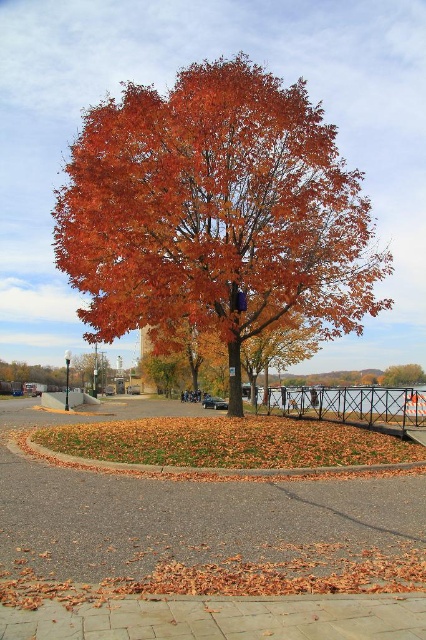
Question: Based on their relative distances, which object is farther from the orange matte tree at center?

Choices:
 (A) brown brick pavement at center
 (B) shiny orange leaves at center

Answer: (A)

Question: Does brown brick pavement at center have a greater width compared to orange matte tree at center?

Choices:
 (A) no
 (B) yes

Answer: (B)

Question: Is brown brick pavement at center above orange matte tree at center?

Choices:
 (A) no
 (B) yes

Answer: (B)

Question: Which point is closer to the camera taking this photo?

Choices:
 (A) (210, 161)
 (B) (81, 376)
 (C) (114, 497)

Answer: (C)

Question: Does shiny orange leaves at center come in front of brown brick pavement at center?

Choices:
 (A) no
 (B) yes

Answer: (A)

Question: Which point is closer to the camera taking this photo?

Choices:
 (A) (100, 140)
 (B) (411, 477)

Answer: (B)